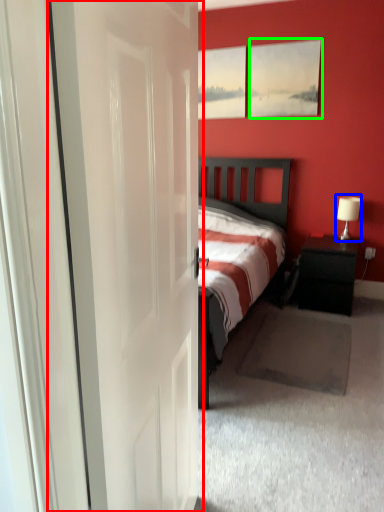
Question: Which object is the farthest from door (highlighted by a red box)? Choose among these: table lamp (highlighted by a blue box) or picture frame (highlighted by a green box).

Choices:
 (A) table lamp
 (B) picture frame

Answer: (B)